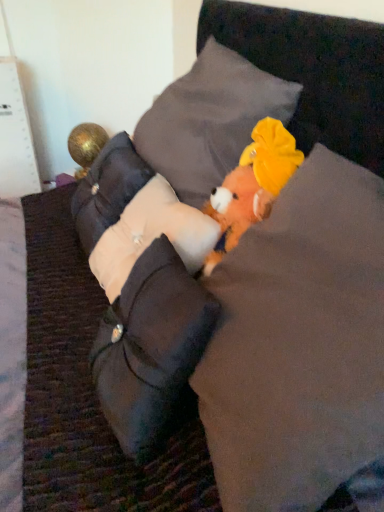
Question: Does white fabric pillow at center, the 2th pillow when ordered from bottom to top, have a greater width compared to beige fabric pillow at left, the 3th pillow in the bottom-to-top sequence?

Choices:
 (A) no
 (B) yes

Answer: (B)

Question: From the image's perspective, is white fabric pillow at center, the 2th pillow when ordered from bottom to top, located above beige fabric pillow at left, the 2th pillow positioned from the top?

Choices:
 (A) no
 (B) yes

Answer: (A)

Question: Is white fabric pillow at center, which is the third pillow in top-to-bottom order, further to camera compared to beige fabric pillow at left, the 3th pillow in the bottom-to-top sequence?

Choices:
 (A) no
 (B) yes

Answer: (A)

Question: Can you confirm if white fabric pillow at center, the 2th pillow when ordered from bottom to top, is taller than beige fabric pillow at left, the 2th pillow positioned from the top?

Choices:
 (A) yes
 (B) no

Answer: (B)

Question: Considering the relative sizes of white fabric pillow at center, the 2th pillow when ordered from bottom to top, and beige fabric pillow at left, the 3th pillow in the bottom-to-top sequence, in the image provided, is white fabric pillow at center, the 2th pillow when ordered from bottom to top, bigger than beige fabric pillow at left, the 3th pillow in the bottom-to-top sequence,?

Choices:
 (A) no
 (B) yes

Answer: (A)

Question: Does beige fabric pillow at left, the 2th pillow positioned from the top, lie behind white fabric pillow at center, which is the third pillow in top-to-bottom order?

Choices:
 (A) no
 (B) yes

Answer: (B)

Question: From the image's perspective, is beige fabric pillow at left, the 2th pillow positioned from the top, under white fabric pillow at center, which is the third pillow in top-to-bottom order?

Choices:
 (A) yes
 (B) no

Answer: (B)

Question: Does beige fabric pillow at left, the 3th pillow in the bottom-to-top sequence, have a smaller size compared to white fabric pillow at center, the 2th pillow when ordered from bottom to top?

Choices:
 (A) no
 (B) yes

Answer: (A)

Question: Is beige fabric pillow at left, the 2th pillow positioned from the top, oriented towards white fabric pillow at center, the 2th pillow when ordered from bottom to top?

Choices:
 (A) no
 (B) yes

Answer: (A)

Question: Considering the relative sizes of beige fabric pillow at left, the 3th pillow in the bottom-to-top sequence, and white fabric pillow at center, the 2th pillow when ordered from bottom to top, in the image provided, is beige fabric pillow at left, the 3th pillow in the bottom-to-top sequence, wider than white fabric pillow at center, the 2th pillow when ordered from bottom to top,?

Choices:
 (A) no
 (B) yes

Answer: (A)

Question: From a real-world perspective, is beige fabric pillow at left, the 3th pillow in the bottom-to-top sequence, positioned under white fabric pillow at center, the 2th pillow when ordered from bottom to top, based on gravity?

Choices:
 (A) yes
 (B) no

Answer: (B)

Question: Considering the relative sizes of fluffy orange plush toy at center and white fabric pillow at center, the 2th pillow when ordered from bottom to top, in the image provided, is fluffy orange plush toy at center bigger than white fabric pillow at center, the 2th pillow when ordered from bottom to top,?

Choices:
 (A) no
 (B) yes

Answer: (B)